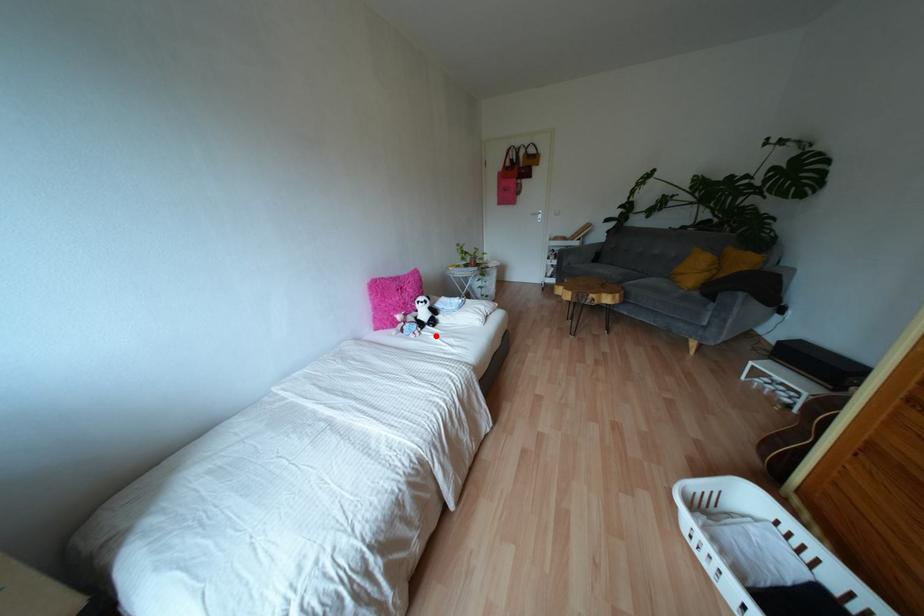
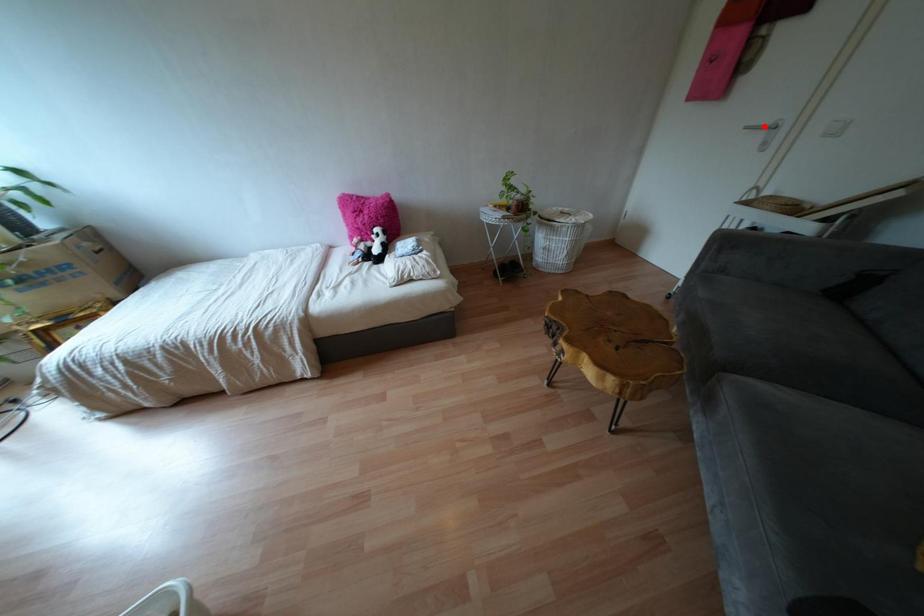
I am providing you with two images of the same scene from different viewpoints. A red point is marked on the first image and another point is marked on the second image. Are the points marked in image1 and image2 representing the same 3D position?

No